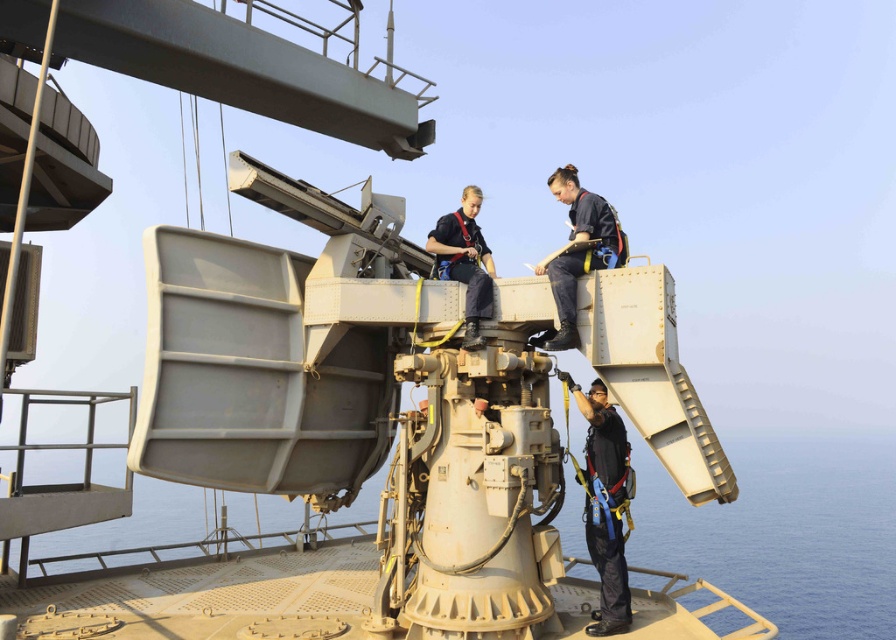
Question: Does black fabric harness at center appear under dark blue uniform at upper right?

Choices:
 (A) no
 (B) yes

Answer: (B)

Question: Is smooth tan water at lower center bigger than dark blue uniform at center?

Choices:
 (A) no
 (B) yes

Answer: (B)

Question: Is dark blue uniform at upper right to the left of dark blue uniform at center from the viewer's perspective?

Choices:
 (A) no
 (B) yes

Answer: (A)

Question: Which point is closer to the camera?

Choices:
 (A) dark blue uniform at upper right
 (B) smooth tan water at lower center
 (C) black fabric harness at center
 (D) dark blue uniform at center

Answer: (A)

Question: Which of the following is the closest to the observer?

Choices:
 (A) dark blue uniform at upper right
 (B) black fabric harness at center
 (C) dark blue uniform at center

Answer: (A)

Question: Among these objects, which one is farthest from the camera?

Choices:
 (A) dark blue uniform at center
 (B) smooth tan water at lower center
 (C) black fabric harness at center
 (D) dark blue uniform at upper right

Answer: (B)